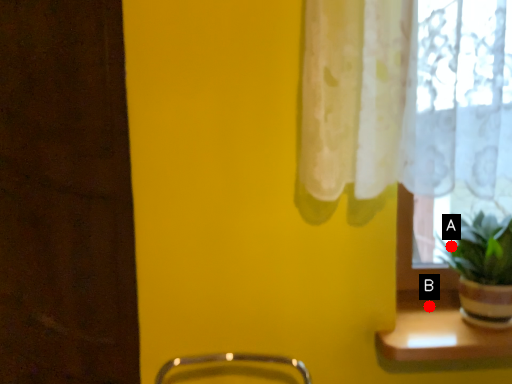
Question: Two points are circled on the image, labeled by A and B beside each circle. Among these points, which one is nearest to the camera?

Choices:
 (A) A is closer
 (B) B is closer

Answer: (A)